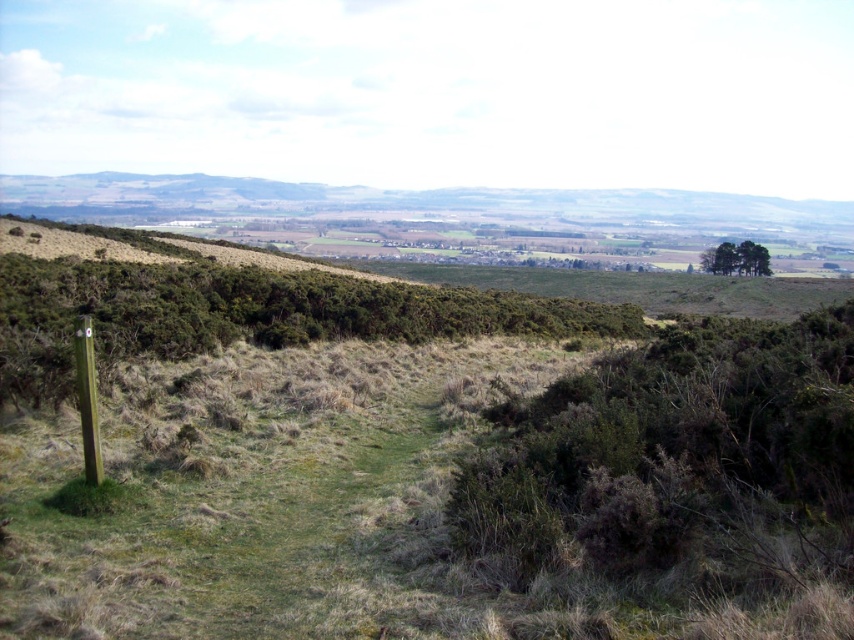
Looking at this image, between green leafy shrubs at lower left and green wooden pole at left, which one has more height?

green leafy shrubs at lower left is taller.

Find the location of a particular element. green leafy shrubs at lower left is located at coordinates (244, 314).

Is point (287, 289) positioned before point (747, 259)?

Yes, point (287, 289) is closer to viewer.

Is green leafy shrubs at lower left smaller than green leafy trees at upper right?

Yes, green leafy shrubs at lower left is smaller than green leafy trees at upper right.

Where is `green leafy shrubs at lower left`? This screenshot has height=640, width=854. green leafy shrubs at lower left is located at coordinates (244, 314).

Who is positioned more to the left, green wooden pole at left or green leafy trees at upper right?

green wooden pole at left

This screenshot has height=640, width=854. I want to click on green wooden pole at left, so click(x=86, y=397).